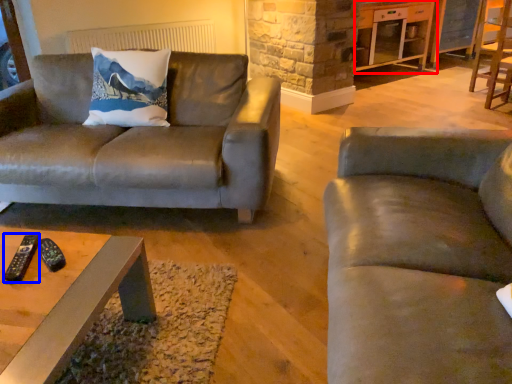
Question: Which object is further to the camera taking this photo, entertainment center (highlighted by a red box) or remote (highlighted by a blue box)?

Choices:
 (A) entertainment center
 (B) remote

Answer: (A)